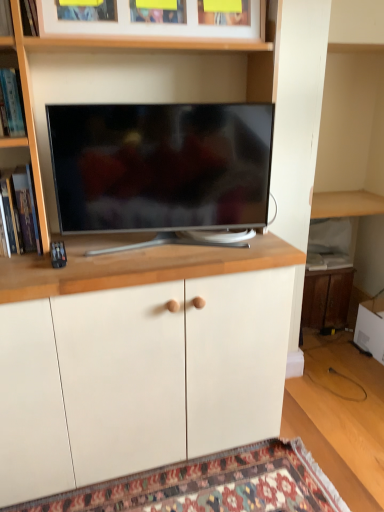
Question: Looking at the image, does wooden bookshelf at left, the 3th shelf from the top, seem bigger or smaller compared to wooden cabinet at lower right, which ranks as the first cabinetry in back-to-front order?

Choices:
 (A) big
 (B) small

Answer: (B)

Question: Is wooden bookshelf at left, the first shelf when ordered from bottom to top, wider or thinner than wooden cabinet at lower right, which ranks as the first cabinetry in back-to-front order?

Choices:
 (A) thin
 (B) wide

Answer: (A)

Question: Which object is positioned farthest from the hardcover book at left?

Choices:
 (A) matte wood shelf at upper left, marked as the third shelf in a bottom-to-top arrangement
 (B) carpeted mat at lower center
 (C) matte black tv at center
 (D) white matte cabinet at center, which ranks as the second cabinetry in right-to-left order
 (E) wooden picture frame at upper center

Answer: (B)

Question: Which of these objects is positioned closest to the carpeted mat at lower center?

Choices:
 (A) wooden picture frame at upper center
 (B) wooden bookshelf at left, the first shelf when ordered from bottom to top
 (C) white matte cabinet at center, acting as the first cabinetry starting from the front
 (D) matte wood shelf at upper left, positioned as the 1th shelf in top-to-bottom order
 (E) matte black tv at center

Answer: (C)